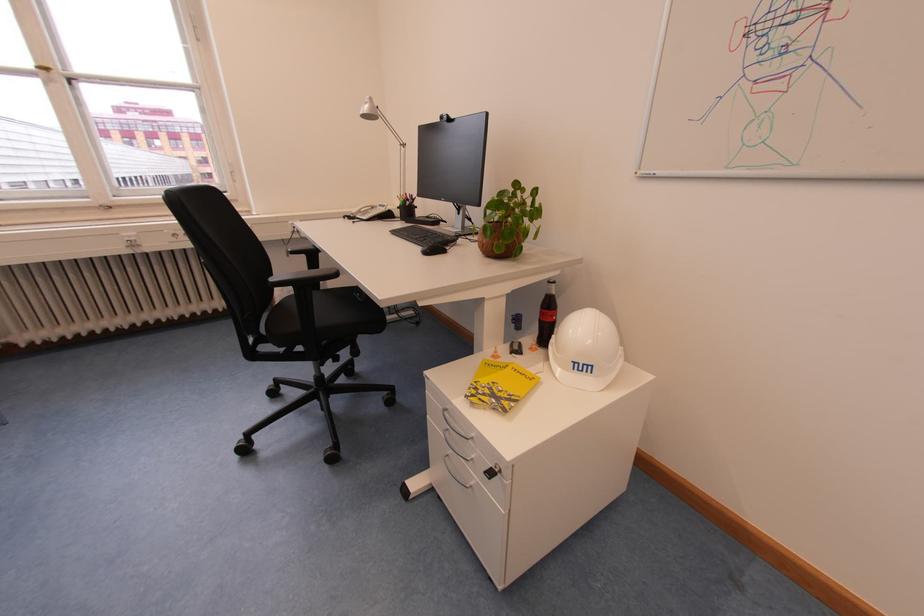
Where is `brass window latch`? The image size is (924, 616). brass window latch is located at coordinates (43, 68).